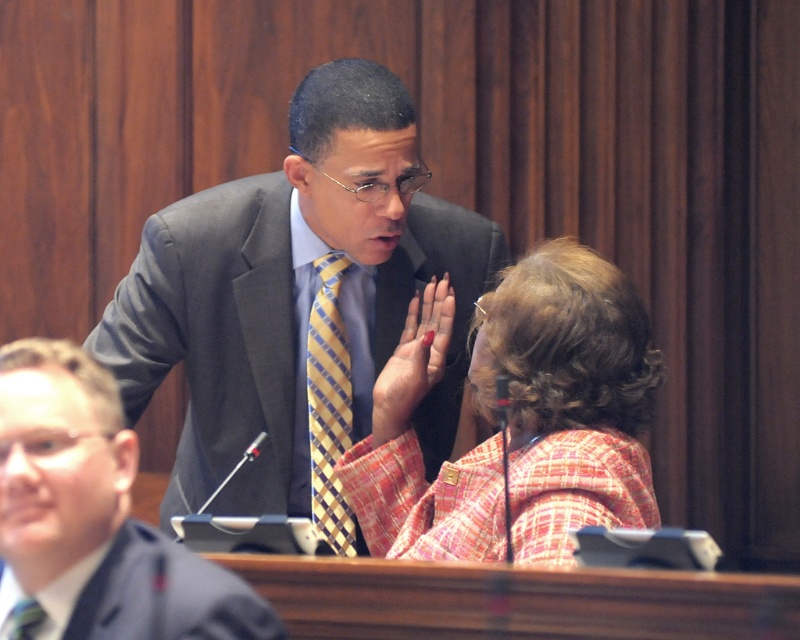
You are a photographer standing at the camera position. You want to take a closeup shot of the yellow checkered tie at center. Can you estimate how far you need to move forward to get a better closeup?

The yellow checkered tie at center is 8.16 feet away from the camera. To get a closer shot, you would need to move forward by approximately 8.16 feet to reach the tie.

In the courtroom scene, there are two individuals wearing the matte gray suit at center and the plaid fabric jacket at center. Which one is positioned to the left?

The matte gray suit at center is positioned to the left of the plaid fabric jacket at center.